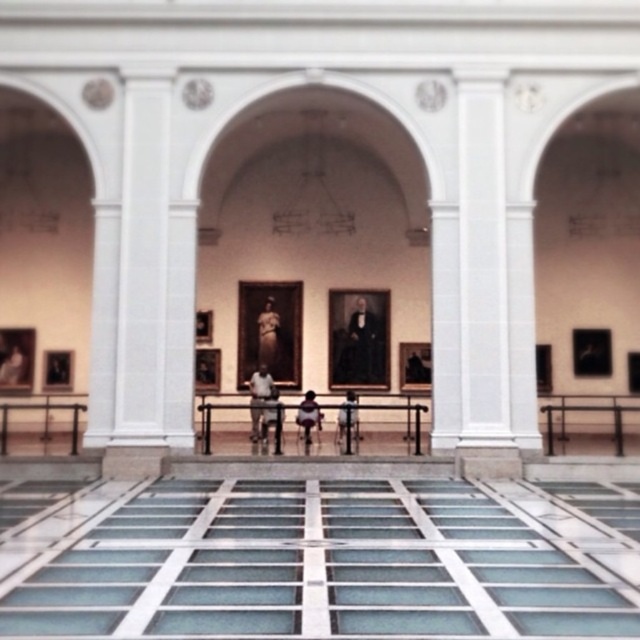
You are a security guard in the museum and need to place a new display stand that is 1 meter wide between the matte gold statue at center and the light brown leather jacket at center. Based on their widths, will the display stand fit between them?

The matte gold statue at center is wider than the light brown leather jacket at center. The display stand that is 1 meter wide may or may not fit depending on the exact space between them, but since the statue is wider, it might take up more room, so you should measure the actual distance before placing the stand.

In the scene shown: You are standing in the museum and want to take a photo of the smooth black portrait at center. If you are facing the wall where it is displayed, which direction should you move to get closer to it?

Since the smooth black portrait at center is located at coordinates approximately 0.539 on the x and 0.569 on the y axis, you should move forward towards the center of the wall to get closer to it.